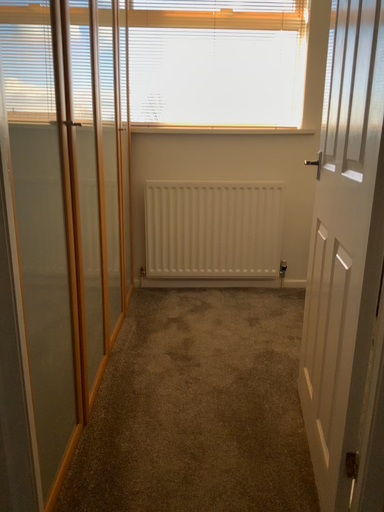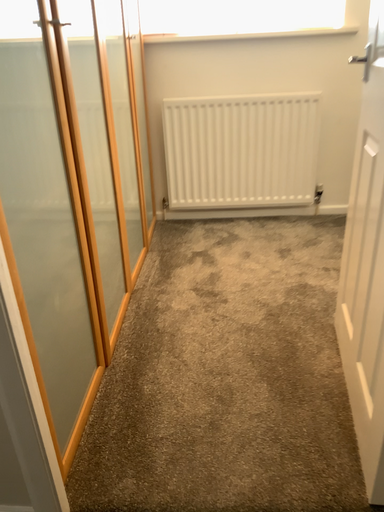
Question: Which way did the camera rotate in the video?

Choices:
 (A) rotated downward
 (B) rotated upward

Answer: (A)